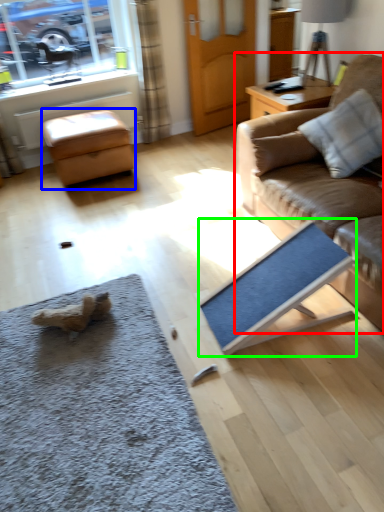
Question: Which object is the closest to the studio couch (highlighted by a red box)? Choose among these: stool (highlighted by a blue box) or yoga mat (highlighted by a green box).

Choices:
 (A) stool
 (B) yoga mat

Answer: (B)